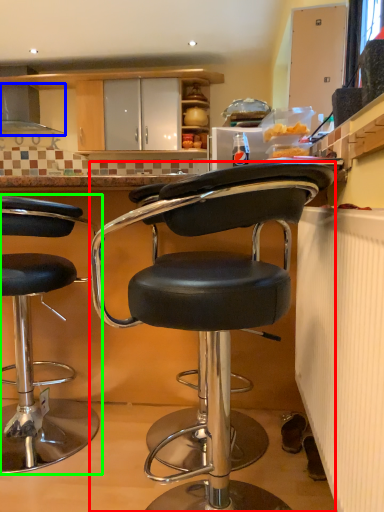
Question: Which object is the farthest from chair (highlighted by a red box)? Choose among these: exhaust hood (highlighted by a blue box) or chair (highlighted by a green box).

Choices:
 (A) exhaust hood
 (B) chair

Answer: (A)